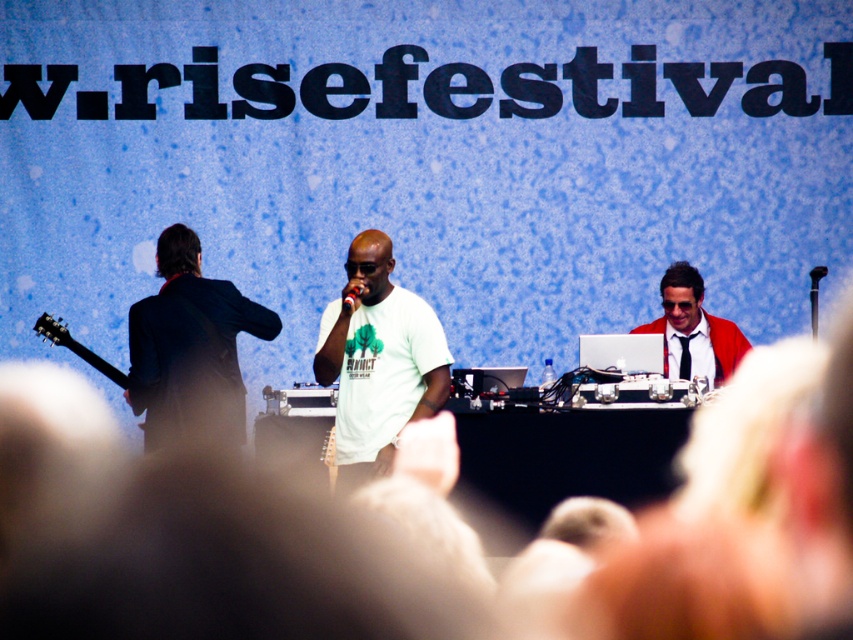
Between dark blue suit at left and black plastic microphone at center, which one is positioned higher?

black plastic microphone at center is above.

This screenshot has width=853, height=640. Describe the element at coordinates (190, 348) in the screenshot. I see `dark blue suit at left` at that location.

Locate an element on the screen. This screenshot has width=853, height=640. dark blue suit at left is located at coordinates (190, 348).

Is white matte t-shirt at center thinner than dark blue suit at left?

Yes.

Can you confirm if white matte t-shirt at center is positioned to the left of dark blue suit at left?

No, white matte t-shirt at center is not to the left of dark blue suit at left.

Is point (337, 320) farther from viewer compared to point (195, 292)?

No, (337, 320) is closer to viewer.

In order to click on white matte t-shirt at center in this screenshot , I will do `click(378, 362)`.

Which of these two, shiny red jacket at center or black plastic microphone at center, stands taller?

Standing taller between the two is shiny red jacket at center.

Which is in front, point (674, 337) or point (351, 308)?

Positioned in front is point (351, 308).

This screenshot has height=640, width=853. What are the coordinates of `shiny red jacket at center` in the screenshot? It's located at (693, 326).